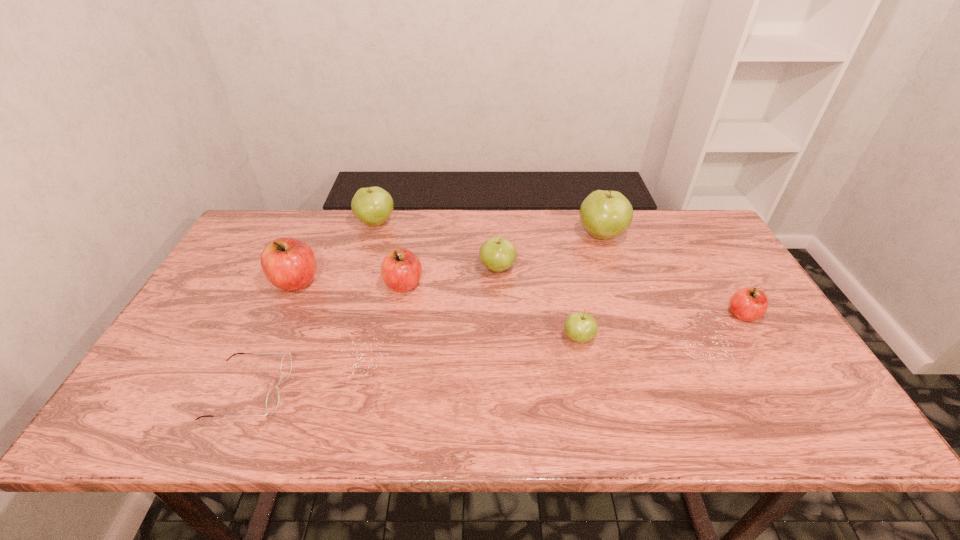
You are a GUI agent. You are given a task and a screenshot of the screen. Output one action in this format:
    pyautogui.click(x=<x>, y=<y>)
    Task: Click on the free spot at the near edge of the desktop
    This screenshot has height=540, width=960.
    Given the screenshot: What is the action you would take?
    pyautogui.click(x=283, y=427)

In the image, there is a desktop. Where is `free space at the left edge`? The height and width of the screenshot is (540, 960). free space at the left edge is located at coordinates (259, 260).

In the image, there is a desktop. What are the coordinates of `blank space at the right edge` in the screenshot? It's located at (788, 392).

The width and height of the screenshot is (960, 540). In order to click on free space between the biggest red apple and the rightmost red apple in this screenshot , I will do `click(519, 298)`.

Identify the location of free space between the third object from left to right and the fourth apple from left to right. (437, 246).

Find the location of `free point between the sixth apple from right to left and the smallest red apple`. free point between the sixth apple from right to left and the smallest red apple is located at coordinates (560, 269).

The height and width of the screenshot is (540, 960). In order to click on free space between the third apple from left to right and the nearest object in this screenshot , I will do `click(326, 338)`.

Locate an element on the screen. The height and width of the screenshot is (540, 960). vacant area between the fourth object from right to left and the nearest green apple is located at coordinates (538, 303).

Where is `vacant space that is in between the second green apple from right to left and the rightmost apple`? vacant space that is in between the second green apple from right to left and the rightmost apple is located at coordinates (660, 326).

You are a GUI agent. You are given a task and a screenshot of the screen. Output one action in this format:
    pyautogui.click(x=<x>, y=<y>)
    Task: Click on the unoccupied area between the fourth object from left to right and the third green apple from left to right
    
    Given the screenshot: What is the action you would take?
    pyautogui.click(x=492, y=311)